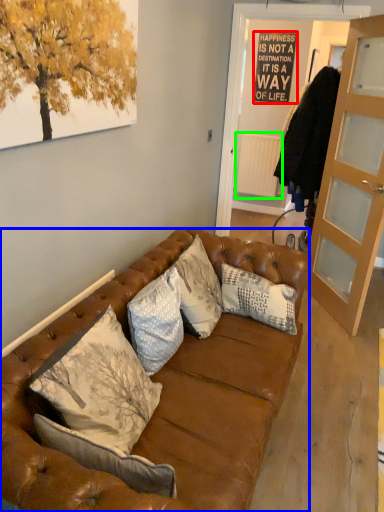
Question: Based on their relative distances, which object is nearer to bulletin board (highlighted by a red box)? Choose from studio couch (highlighted by a blue box) and radiator (highlighted by a green box).

Choices:
 (A) studio couch
 (B) radiator

Answer: (B)